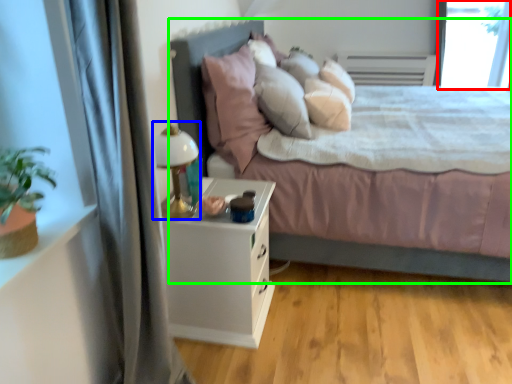
Question: Considering the real-world distances, which object is closest to window screen (highlighted by a red box)? table lamp (highlighted by a blue box) or bed (highlighted by a green box).

Choices:
 (A) table lamp
 (B) bed

Answer: (B)